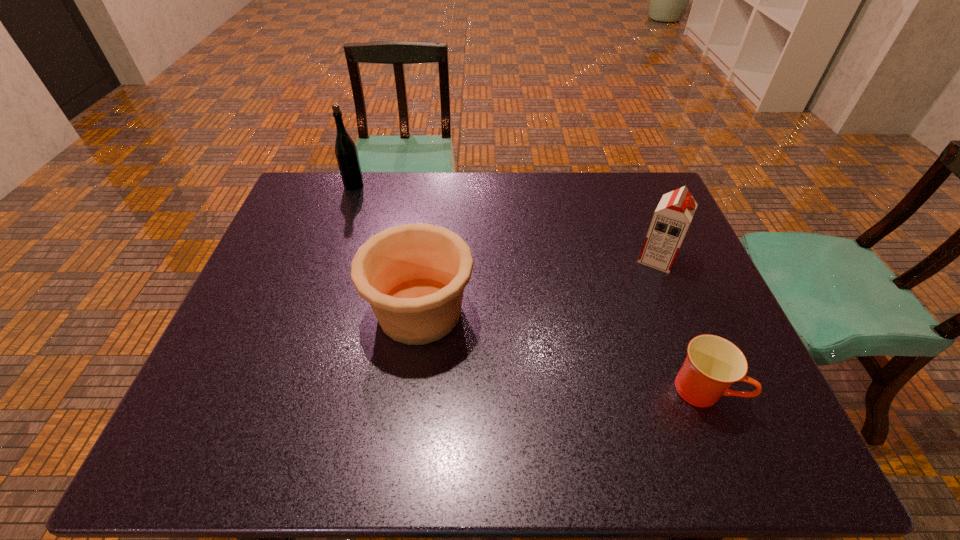
Where is `blank area located on the back of the pottery`? The height and width of the screenshot is (540, 960). blank area located on the back of the pottery is located at coordinates (428, 244).

Find the location of a particular element. Image resolution: width=960 pixels, height=540 pixels. vacant area situated on the back of the shortest object is located at coordinates (666, 296).

Identify the location of object located in the far edge section of the desktop. (346, 152).

Locate an element on the screen. This screenshot has height=540, width=960. object at the left edge is located at coordinates (346, 152).

Identify the location of soya milk located in the right edge section of the desktop. (672, 217).

The image size is (960, 540). I want to click on cup that is at the right edge, so click(713, 364).

Where is `object present at the far left corner`? This screenshot has height=540, width=960. object present at the far left corner is located at coordinates (346, 152).

Locate an element on the screen. The height and width of the screenshot is (540, 960). free space at the far edge of the desktop is located at coordinates (444, 198).

Locate an element on the screen. The image size is (960, 540). free region at the near edge of the desktop is located at coordinates (259, 440).

Locate an element on the screen. vacant space at the left edge of the desktop is located at coordinates (233, 371).